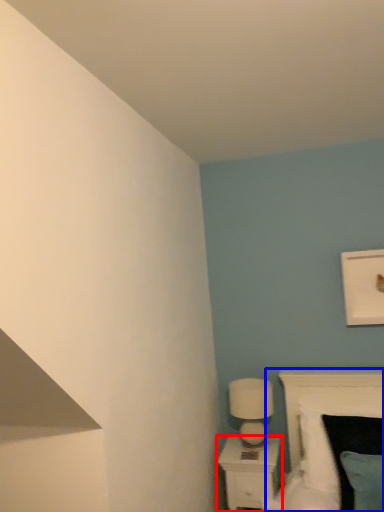
Question: Which object appears closest to the camera in this image, nightstand (highlighted by a red box) or bed (highlighted by a blue box)?

Choices:
 (A) nightstand
 (B) bed

Answer: (B)